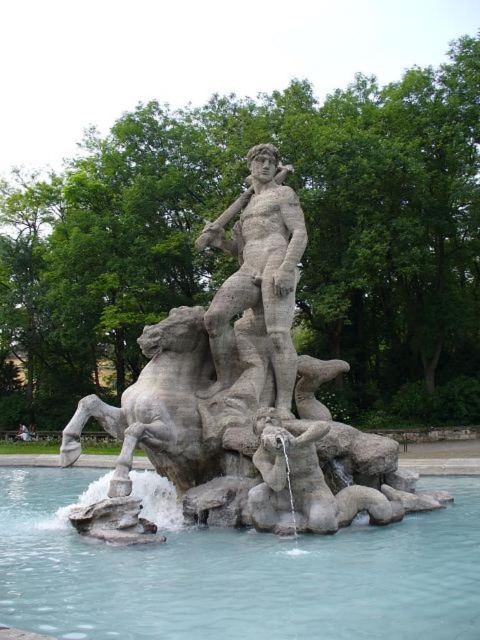
You are standing in front of the classical fountain sculpture. You notice two points on the sculpture marked as point A and point B. If point A corresponds to point (256, 428) and point B corresponds to point (75, 541), which point is closer to you?

Point A is closer to you because it is further to the viewer than point B.

You are planning to take a photo of the clear blue water at center and the gray stone statue at center in the fountain. Which object should you focus on first if you want to capture both in one frame without moving the camera?

You should focus on the clear blue water at center first because it is larger in size compared to the gray stone statue at center, allowing it to be the main subject while still including the statue in the frame.